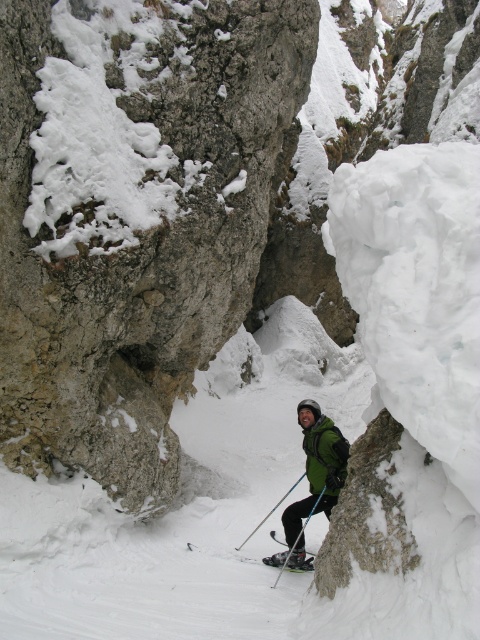
Consider the image. You are a backcountry skier planning to descend through the narrow pass between the two large rocks. You notice your matte black ski at center and your matte black ski pole at center. Which object is closer to you as you look down at your equipment?

The matte black ski at center is closer to you because the matte black ski pole at center is positioned behind it.

You are a backcountry skier preparing to descend a narrow snow pass between two large rocks. You notice your matte black ski at center and your matte black ski pole at center. Which object is located to the right of the other?

The matte black ski at center is positioned on the right side of the matte black ski pole at center, so the ski is to the right of the pole.